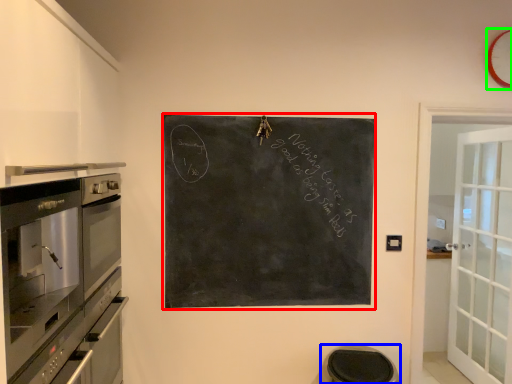
Question: Estimate the real-world distances between objects in this image. Which object is farther from bulletin board (highlighted by a red box), step stool (highlighted by a blue box) or clock (highlighted by a green box)?

Choices:
 (A) step stool
 (B) clock

Answer: (B)